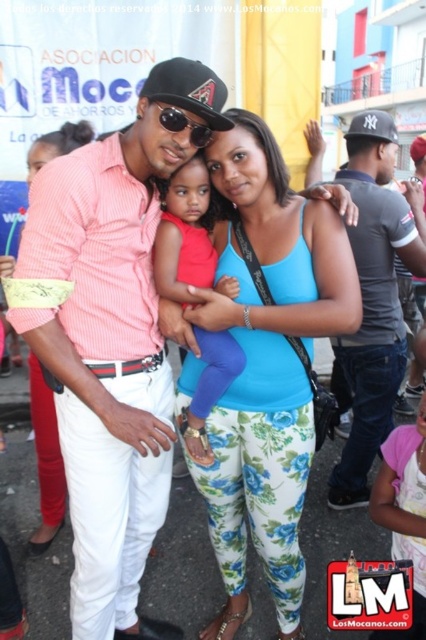
You are a photographer trying to adjust the focus on your camera. You want to ensure both the blue floral leggings at center and the black matte baseball cap at center are in focus. If your camera has a depth of field range of 30 inches, will both objects be in focus?

The blue floral leggings at center is 33.09 inches away from the black matte baseball cap at center. Since the distance between them exceeds the camera depth of field range of 30 inches, both objects cannot be in focus simultaneously.

Please describe the location of the matte red dress at center in the image using coordinates. The answer should be in the format of coordinates in the form of a tuple with two decimal numbers, like this example format. For instance, if the coordinates were at the center of the image, you would write the answer as follows. Answer with the exact coordinates provided in the Objects Description. The coordinates are given as a tuple of two decimal numbers between 0 and 1, where 0 is the bottom left corner and 1,

The coordinates of the matte red dress at center are at point (184, 236).